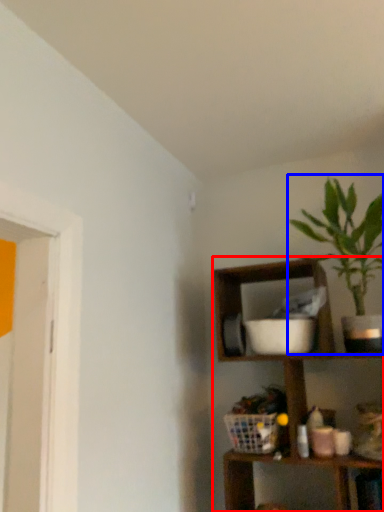
Question: Which object is closer to the camera taking this photo, shelf (highlighted by a red box) or houseplant (highlighted by a blue box)?

Choices:
 (A) shelf
 (B) houseplant

Answer: (A)